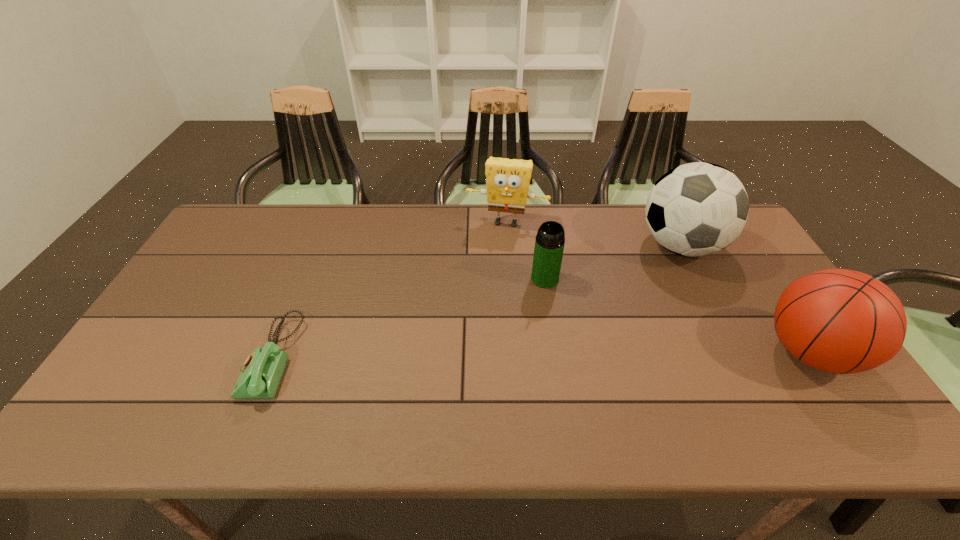
The width and height of the screenshot is (960, 540). In order to click on free space on the desktop that is between the leftmost object and the basketball and is positioned on the face of the sponge in this screenshot , I will do `click(478, 356)`.

At what (x,y) coordinates should I click in order to perform the action: click on vacant space on the desktop that is between the leftmost object and the basketball and is positioned from the spout of the thermos bottle. Please return your answer as a coordinate pair (x, y). Looking at the image, I should click on (503, 355).

Image resolution: width=960 pixels, height=540 pixels. In order to click on free spot on the desktop that is between the telephone and the basketball and is positioned on the main logo of the soccer ball in this screenshot , I will do `click(585, 355)`.